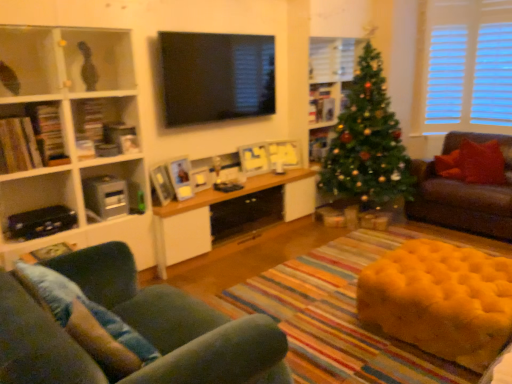
Question: Is wooden picture frame at center, arranged as the fourth shelf when viewed from the front, positioned beyond the bounds of red velvet pillow at right, which is the 2th pillow in bottom-to-top order?

Choices:
 (A) yes
 (B) no

Answer: (A)

Question: Is wooden picture frame at center, which ranks as the second shelf in back-to-front order, facing away from red velvet pillow at right, which ranks as the 2th pillow in left-to-right order?

Choices:
 (A) yes
 (B) no

Answer: (B)

Question: From a real-world perspective, is wooden picture frame at center, which ranks as the second shelf in back-to-front order, physically below red velvet pillow at right, which is the first pillow in top-to-bottom order?

Choices:
 (A) yes
 (B) no

Answer: (B)

Question: Does wooden picture frame at center, arranged as the fourth shelf when viewed from the front, have a greater height compared to red velvet pillow at right, which appears as the 2th pillow when viewed from the front?

Choices:
 (A) yes
 (B) no

Answer: (B)

Question: Is the position of wooden picture frame at center, arranged as the fourth shelf when viewed from the front, more distant than that of red velvet pillow at right, acting as the first pillow starting from the back?

Choices:
 (A) yes
 (B) no

Answer: (A)

Question: Does wooden picture frame at center, arranged as the fourth shelf when viewed from the front, have a lesser height compared to red velvet pillow at right, acting as the first pillow starting from the back?

Choices:
 (A) yes
 (B) no

Answer: (A)

Question: Is matte white bookshelf at left, which appears as the 5th shelf when viewed from the back, aimed at black glossy tv at upper center?

Choices:
 (A) no
 (B) yes

Answer: (A)

Question: From a real-world perspective, is matte white bookshelf at left, which is the first shelf from front to back, beneath black glossy tv at upper center?

Choices:
 (A) yes
 (B) no

Answer: (A)

Question: Considering the relative sizes of matte white bookshelf at left, marked as the 2th shelf in a left-to-right arrangement, and black glossy tv at upper center in the image provided, is matte white bookshelf at left, marked as the 2th shelf in a left-to-right arrangement, taller than black glossy tv at upper center?

Choices:
 (A) yes
 (B) no

Answer: (A)

Question: Is matte white bookshelf at left, which appears as the 5th shelf when viewed from the back, outside of black glossy tv at upper center?

Choices:
 (A) no
 (B) yes

Answer: (B)

Question: Is matte white bookshelf at left, marked as the 2th shelf in a left-to-right arrangement, behind black glossy tv at upper center?

Choices:
 (A) no
 (B) yes

Answer: (A)

Question: Considering the relative sizes of matte white bookshelf at left, which is the first shelf from front to back, and black glossy tv at upper center in the image provided, is matte white bookshelf at left, which is the first shelf from front to back, wider than black glossy tv at upper center?

Choices:
 (A) yes
 (B) no

Answer: (A)

Question: Is the position of wooden cabinet at center less distant than that of velvet green sofa at lower left, the first studio couch when ordered from left to right?

Choices:
 (A) yes
 (B) no

Answer: (B)